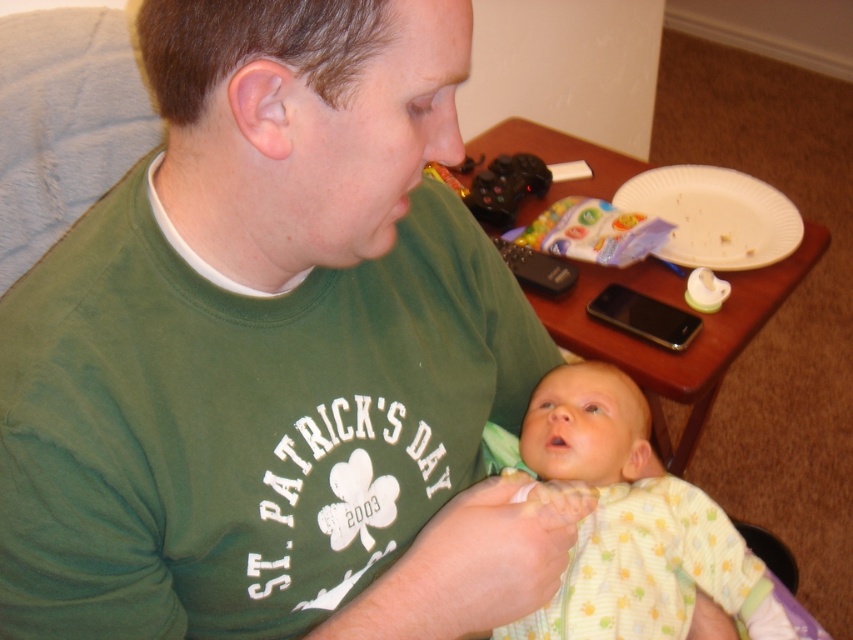
Describe the element at coordinates (630, 522) in the screenshot. I see `light yellow knit onesie at center` at that location.

Can you confirm if light yellow knit onesie at center is smaller than black matte game controller at upper center?

No, light yellow knit onesie at center is not smaller than black matte game controller at upper center.

Which is in front, point (572, 630) or point (514, 186)?

Positioned in front is point (572, 630).

At what (x,y) coordinates should I click in order to perform the action: click on light yellow knit onesie at center. Please return your answer as a coordinate pair (x, y). This screenshot has width=853, height=640. Looking at the image, I should click on (630, 522).

Based on the photo, can you confirm if light yellow knit onesie at center is thinner than white paper plate at upper right?

Incorrect, light yellow knit onesie at center's width is not less than white paper plate at upper right's.

The height and width of the screenshot is (640, 853). I want to click on light yellow knit onesie at center, so click(630, 522).

Consider the image. Who is more forward, (599, 458) or (762, 250)?

Point (599, 458) is in front.

This screenshot has height=640, width=853. In order to click on light yellow knit onesie at center in this screenshot , I will do `click(630, 522)`.

Can you confirm if white paper plate at upper right is smaller than black matte game controller at upper center?

Actually, white paper plate at upper right might be larger than black matte game controller at upper center.

This screenshot has width=853, height=640. I want to click on white paper plate at upper right, so click(x=714, y=216).

Locate an element on the screen. white paper plate at upper right is located at coordinates (714, 216).

Where is `white paper plate at upper right`? The width and height of the screenshot is (853, 640). white paper plate at upper right is located at coordinates (714, 216).